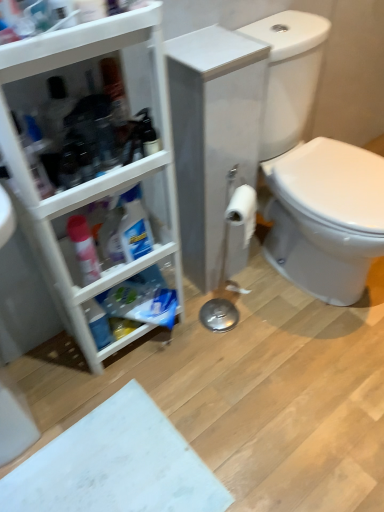
Question: From a real-world perspective, is white plastic cabinet at left positioned above or below white glossy toilet at right?

Choices:
 (A) below
 (B) above

Answer: (B)

Question: Considering their positions, is white plastic cabinet at left located in front of or behind white glossy toilet at right?

Choices:
 (A) front
 (B) behind

Answer: (A)

Question: Estimate the real-world distances between objects in this image. Which object is closer to the white plastic cabinet at left?

Choices:
 (A) translucent plastic spray bottle at left
 (B) white matte toilet paper at center
 (C) white glossy toilet at right

Answer: (A)

Question: Estimate the real-world distances between objects in this image. Which object is farther from the translucent plastic spray bottle at left?

Choices:
 (A) white matte toilet paper at center
 (B) white plastic cabinet at left
 (C) white glossy toilet at right

Answer: (C)